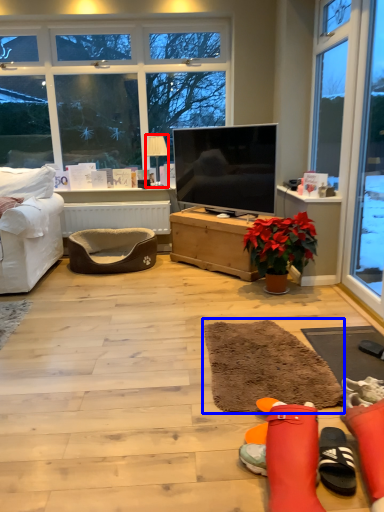
Question: Which object is closer to the camera taking this photo, lamp (highlighted by a red box) or flat (highlighted by a blue box)?

Choices:
 (A) lamp
 (B) flat

Answer: (B)